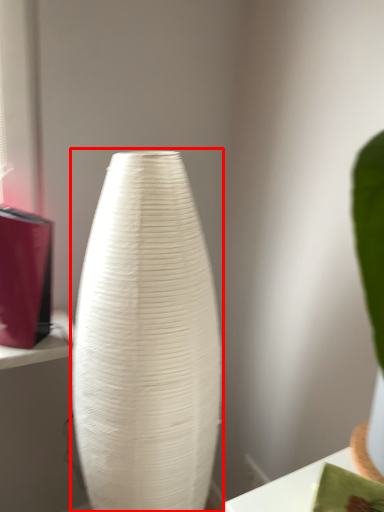
Question: Observing the image, what is the correct spatial positioning of vase (annotated by the red box) in reference to table?

Choices:
 (A) right
 (B) left

Answer: (B)